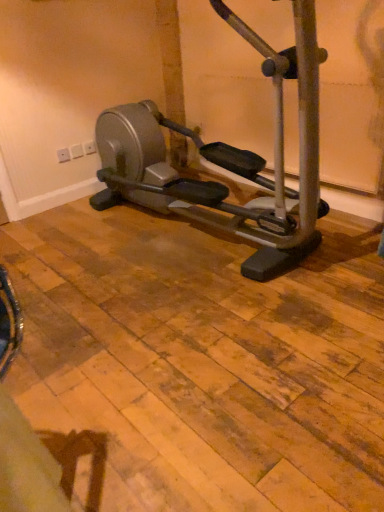
What do you see at coordinates (218, 183) in the screenshot? The height and width of the screenshot is (512, 384). I see `silver metallic stationary bicycle at center` at bounding box center [218, 183].

Identify the location of silver metallic stationary bicycle at center. [x=218, y=183].

Where is `silver metallic stationary bicycle at center`? silver metallic stationary bicycle at center is located at coordinates (218, 183).